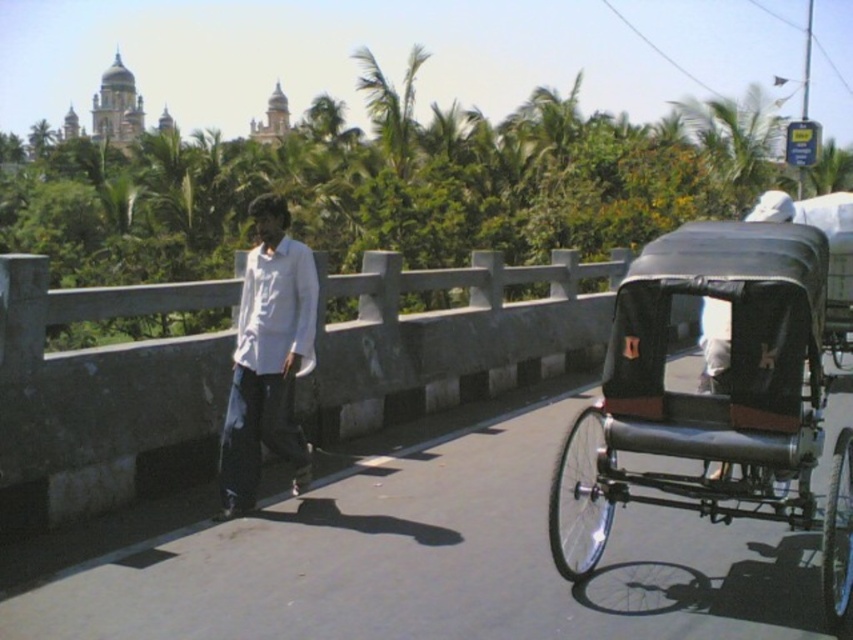
Question: Is black leather rickshaw at right thinner than white matte shirt at center?

Choices:
 (A) no
 (B) yes

Answer: (A)

Question: Considering the relative positions of black leather rickshaw at right and white matte shirt at center in the image provided, where is black leather rickshaw at right located with respect to white matte shirt at center?

Choices:
 (A) above
 (B) below

Answer: (B)

Question: Is black leather rickshaw at right wider than white matte shirt at center?

Choices:
 (A) no
 (B) yes

Answer: (B)

Question: Which of the following is the closest to the observer?

Choices:
 (A) pyautogui.click(x=769, y=381)
 (B) pyautogui.click(x=238, y=483)

Answer: (A)